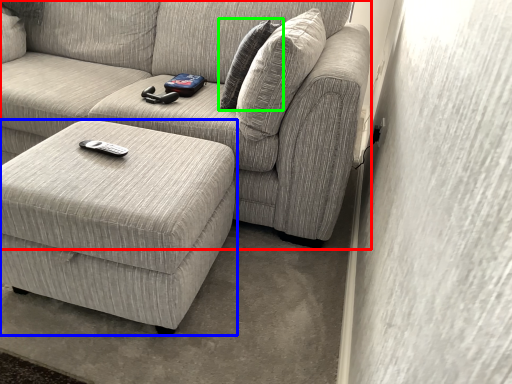
Question: Which is farther away from studio couch (highlighted by a red box)? table (highlighted by a blue box) or pillow (highlighted by a green box)?

Choices:
 (A) table
 (B) pillow

Answer: (A)